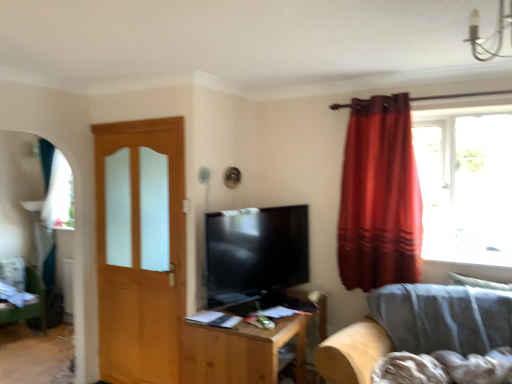
Question: Is green fabric swivel chair at lower left at the right side of wooden table at center?

Choices:
 (A) yes
 (B) no

Answer: (B)

Question: Is green fabric swivel chair at lower left completely or partially outside of wooden table at center?

Choices:
 (A) no
 (B) yes

Answer: (B)

Question: Is green fabric swivel chair at lower left not close to wooden table at center?

Choices:
 (A) no
 (B) yes

Answer: (B)

Question: Is green fabric swivel chair at lower left next to wooden table at center and touching it?

Choices:
 (A) no
 (B) yes

Answer: (A)

Question: Can you confirm if green fabric swivel chair at lower left is positioned to the left of wooden table at center?

Choices:
 (A) no
 (B) yes

Answer: (B)

Question: Considering the relative positions of white glass chandelier at upper right and green fabric swivel chair at lower left in the image provided, is white glass chandelier at upper right to the left or to the right of green fabric swivel chair at lower left?

Choices:
 (A) left
 (B) right

Answer: (B)

Question: Is white glass chandelier at upper right taller or shorter than green fabric swivel chair at lower left?

Choices:
 (A) tall
 (B) short

Answer: (B)

Question: Is white glass chandelier at upper right bigger or smaller than green fabric swivel chair at lower left?

Choices:
 (A) small
 (B) big

Answer: (A)

Question: From the image's perspective, is white glass chandelier at upper right located above or below green fabric swivel chair at lower left?

Choices:
 (A) above
 (B) below

Answer: (A)

Question: From the image's perspective, is green fabric swivel chair at lower left positioned above or below white glass chandelier at upper right?

Choices:
 (A) above
 (B) below

Answer: (B)

Question: Considering their positions, is green fabric swivel chair at lower left located in front of or behind white glass chandelier at upper right?

Choices:
 (A) behind
 (B) front

Answer: (A)

Question: From a real-world perspective, is green fabric swivel chair at lower left physically located above or below white glass chandelier at upper right?

Choices:
 (A) above
 (B) below

Answer: (B)

Question: Would you say green fabric swivel chair at lower left is to the left or to the right of white glass chandelier at upper right in the picture?

Choices:
 (A) left
 (B) right

Answer: (A)

Question: Considering the positions of point (218, 228) and point (348, 380), is point (218, 228) closer or farther from the camera than point (348, 380)?

Choices:
 (A) closer
 (B) farther

Answer: (B)

Question: Would you say matte black tv at center is to the left or to the right of gray fabric couch at lower right in the picture?

Choices:
 (A) right
 (B) left

Answer: (B)